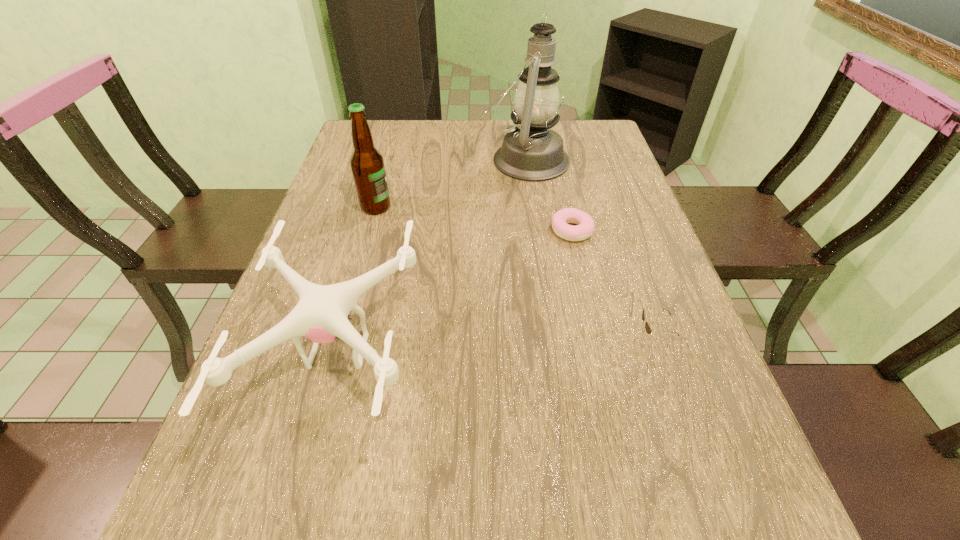
Locate an element on the screen. the tallest object is located at coordinates (531, 151).

Find the location of `the farthest object`. the farthest object is located at coordinates (531, 151).

You are a GUI agent. You are given a task and a screenshot of the screen. Output one action in this format:
    pyautogui.click(x=<x>, y=<y>)
    Task: Click on the second farthest object
    The width and height of the screenshot is (960, 540).
    Given the screenshot: What is the action you would take?
    pyautogui.click(x=367, y=164)

I want to click on beer bottle, so click(367, 164).

Locate an element on the screen. The width and height of the screenshot is (960, 540). the third tallest object is located at coordinates (321, 315).

Where is `the rightmost object`? Image resolution: width=960 pixels, height=540 pixels. the rightmost object is located at coordinates (648, 329).

Find the location of a particular element. the fourth tallest object is located at coordinates (648, 329).

The image size is (960, 540). Find the location of `the third nearest object`. the third nearest object is located at coordinates (585, 226).

This screenshot has height=540, width=960. In order to click on pastry in this screenshot , I will do `click(585, 226)`.

At what (x,y) coordinates should I click in order to perform the action: click on vacant area situated 0.150m on the front of the oil lamp. Please return your answer as a coordinate pair (x, y). This screenshot has height=540, width=960. Looking at the image, I should click on (532, 214).